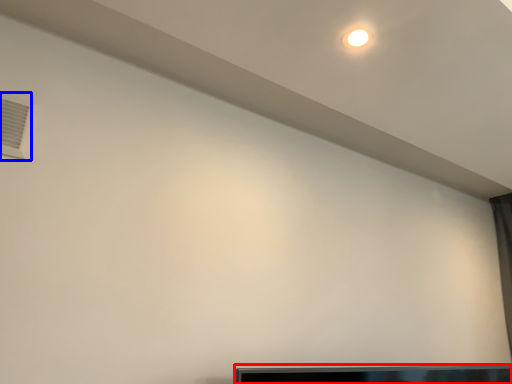
Question: Which point is further to the camera, furniture (highlighted by a red box) or air conditioning (highlighted by a blue box)?

Choices:
 (A) furniture
 (B) air conditioning

Answer: (A)